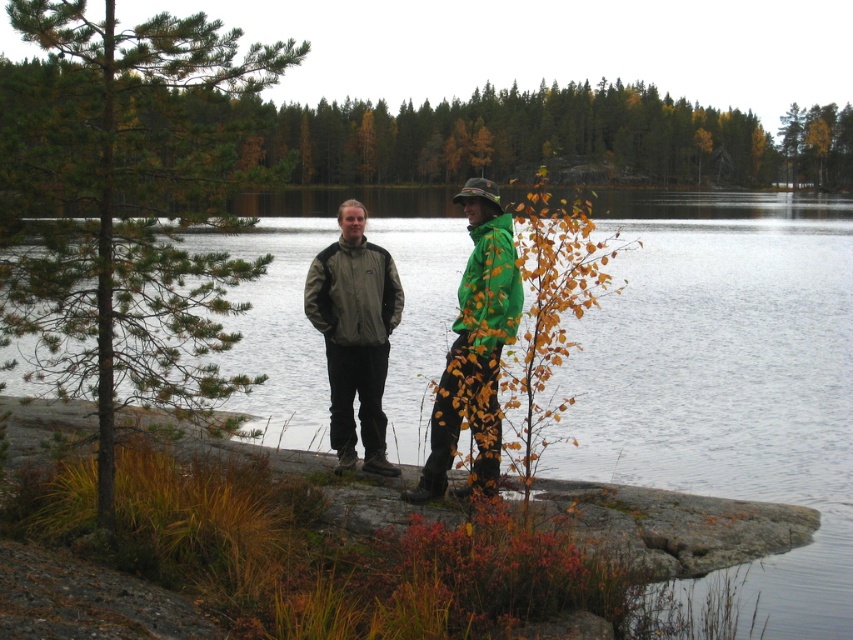
Between transparent water at center and green pine tree at left, which one is positioned lower?

green pine tree at left is lower down.

Based on the photo, can you confirm if transparent water at center is positioned to the right of green pine tree at left?

Indeed, transparent water at center is positioned on the right side of green pine tree at left.

Which is in front, point (656, 308) or point (33, 273)?

Point (33, 273) is in front.

You are a GUI agent. You are given a task and a screenshot of the screen. Output one action in this format:
    pyautogui.click(x=<x>, y=<y>)
    Task: Click on the transparent water at center
    This screenshot has width=853, height=640.
    Given the screenshot: What is the action you would take?
    pyautogui.click(x=727, y=376)

Is point (50, 365) positioned behind point (340, 218)?

That is False.

Between green pine tree at left and matte gray jacket at center, which one appears on the right side from the viewer's perspective?

matte gray jacket at center

Is point (117, 208) closer to camera compared to point (383, 282)?

Yes.

Find the location of a particular element. This screenshot has width=853, height=640. green pine tree at left is located at coordinates pyautogui.click(x=120, y=205).

Which is more to the left, green pine tree at left or green matte tree at upper center?

From the viewer's perspective, green pine tree at left appears more on the left side.

Image resolution: width=853 pixels, height=640 pixels. Describe the element at coordinates (120, 205) in the screenshot. I see `green pine tree at left` at that location.

Which is behind, point (190, 314) or point (74, 132)?

Point (190, 314)

You are a GUI agent. You are given a task and a screenshot of the screen. Output one action in this format:
    pyautogui.click(x=<x>, y=<y>)
    Task: Click on the green pine tree at left
    The height and width of the screenshot is (640, 853).
    Given the screenshot: What is the action you would take?
    pyautogui.click(x=120, y=205)